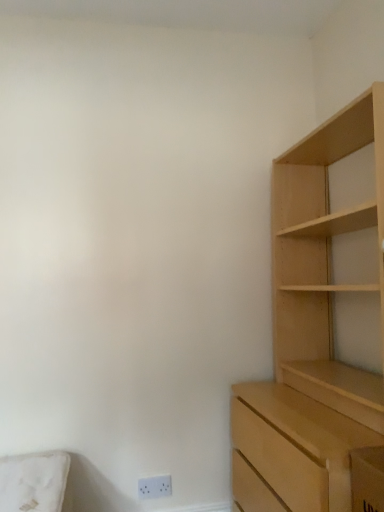
Question: Does light wood cupboard at right have a lesser height compared to white plastic electric outlet at lower center?

Choices:
 (A) no
 (B) yes

Answer: (A)

Question: From a real-world perspective, is light wood cupboard at right physically above white plastic electric outlet at lower center?

Choices:
 (A) no
 (B) yes

Answer: (B)

Question: Does light wood cupboard at right have a larger size compared to white plastic electric outlet at lower center?

Choices:
 (A) no
 (B) yes

Answer: (B)

Question: Is light wood cupboard at right smaller than white plastic electric outlet at lower center?

Choices:
 (A) yes
 (B) no

Answer: (B)

Question: From the image's perspective, is light wood cupboard at right on white plastic electric outlet at lower center?

Choices:
 (A) no
 (B) yes

Answer: (B)

Question: Is white plastic electric outlet at lower center surrounded by light wood cupboard at right?

Choices:
 (A) no
 (B) yes

Answer: (A)

Question: Is white plastic electric outlet at lower center shorter than light wood cupboard at right?

Choices:
 (A) yes
 (B) no

Answer: (A)

Question: Can you confirm if white plastic electric outlet at lower center is smaller than light wood cupboard at right?

Choices:
 (A) yes
 (B) no

Answer: (A)

Question: From a real-world perspective, is white plastic electric outlet at lower center physically below light wood cupboard at right?

Choices:
 (A) no
 (B) yes

Answer: (B)

Question: Is white plastic electric outlet at lower center next to light wood cupboard at right and touching it?

Choices:
 (A) yes
 (B) no

Answer: (B)

Question: Does white plastic electric outlet at lower center appear on the left side of light wood cupboard at right?

Choices:
 (A) no
 (B) yes

Answer: (B)

Question: From a real-world perspective, is white plastic electric outlet at lower center on light wood cupboard at right?

Choices:
 (A) no
 (B) yes

Answer: (A)

Question: Is white plastic electric outlet at lower center situated inside light wood cupboard at right or outside?

Choices:
 (A) outside
 (B) inside

Answer: (A)